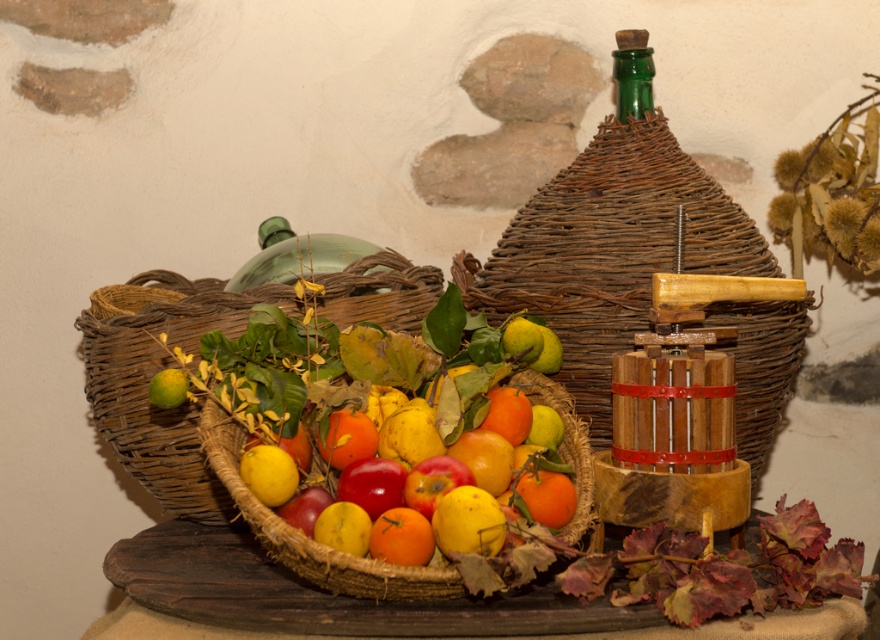
Question: Among these objects, which one is nearest to the camera?

Choices:
 (A) green matte lemon at left
 (B) glossy orange fruit at center
 (C) green glass bottle at upper right
 (D) green glass bottle at upper center

Answer: (B)

Question: Does green glass bottle at upper center come in front of yellow matte apple at center?

Choices:
 (A) no
 (B) yes

Answer: (A)

Question: Can you confirm if green glass bottle at upper center is positioned below green glass bottle at upper right?

Choices:
 (A) yes
 (B) no

Answer: (A)

Question: Does glossy orange fruit at center have a larger size compared to green matte lemon at left?

Choices:
 (A) yes
 (B) no

Answer: (A)

Question: Which object appears closest to the camera in this image?

Choices:
 (A) glossy orange fruit at center
 (B) yellow matte apple at center

Answer: (A)

Question: Which object is the farthest from the green matte lemon at left?

Choices:
 (A) green glass bottle at upper center
 (B) glossy orange fruit at center

Answer: (A)